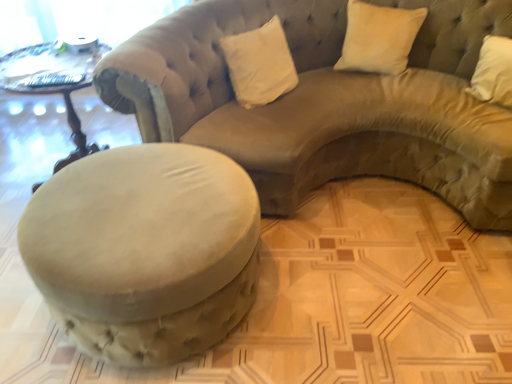
Question: From a real-world perspective, is white velvet pillow at upper center, placed as the first pillow when sorted from left to right, above or below wooden carved table at left?

Choices:
 (A) below
 (B) above

Answer: (B)

Question: In terms of height, does white velvet pillow at upper center, the second pillow when ordered from right to left, look taller or shorter compared to wooden carved table at left?

Choices:
 (A) short
 (B) tall

Answer: (A)

Question: Based on their relative distances, which object is nearer to the suede beige studio couch at center?

Choices:
 (A) wooden carved table at left
 (B) white velvet pillow at upper center, placed as the first pillow when sorted from left to right
 (C) suede ottoman at lower left
 (D) white velvet pillow at upper right, acting as the first pillow starting from the right

Answer: (B)

Question: Estimate the real-world distances between objects in this image. Which object is closer to the suede ottoman at lower left?

Choices:
 (A) suede beige studio couch at center
 (B) wooden carved table at left
 (C) white velvet pillow at upper right, acting as the first pillow starting from the right
 (D) white velvet pillow at upper center, placed as the first pillow when sorted from left to right

Answer: (A)